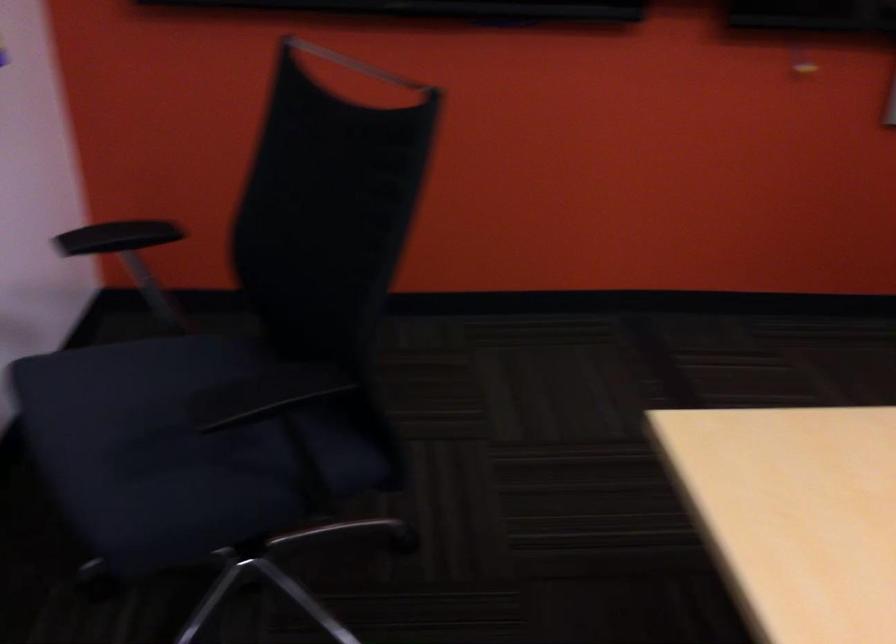
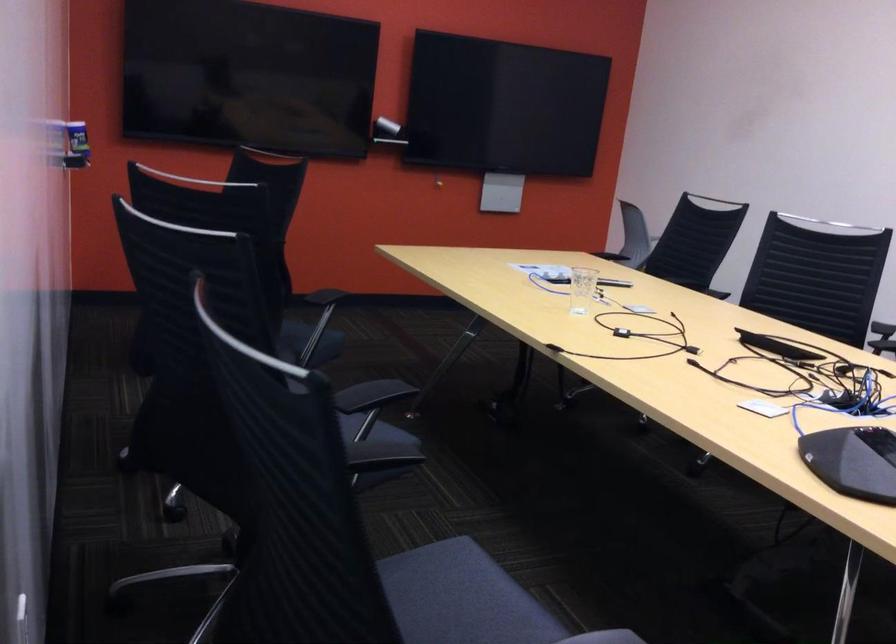
Question: In a continuous first-person perspective shot, in which direction is the camera moving?

Choices:
 (A) Left
 (B) Right
 (C) Forward
 (D) Backward

Answer: (D)